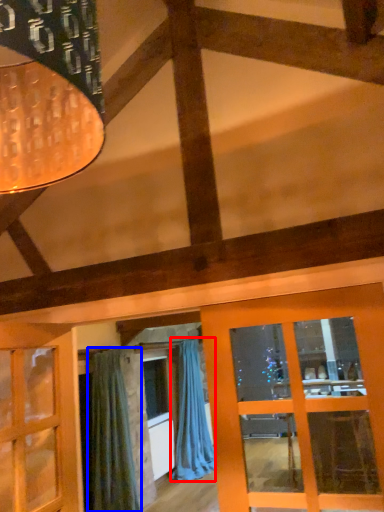
Question: Which of the following is the closest to the observer, curtain (highlighted by a red box) or curtain (highlighted by a blue box)?

Choices:
 (A) curtain
 (B) curtain

Answer: (B)